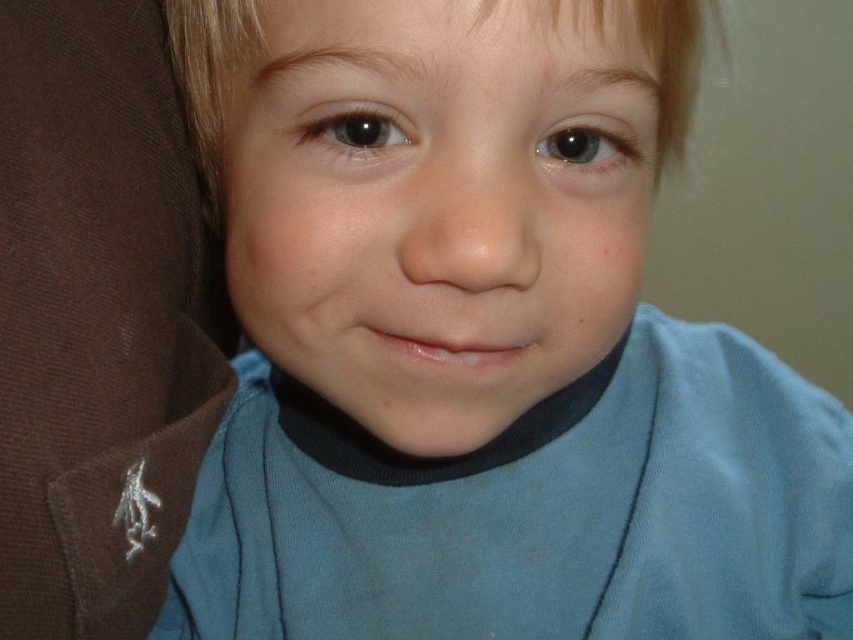
Who is more forward, (178, 488) or (171, 3)?

Point (171, 3)

Does matte brown fabric at left appear on the right side of blonde smooth hair at center?

No, matte brown fabric at left is not to the right of blonde smooth hair at center.

Where is `matte brown fabric at left`? The width and height of the screenshot is (853, 640). matte brown fabric at left is located at coordinates (97, 317).

Locate an element on the screen. This screenshot has width=853, height=640. matte brown fabric at left is located at coordinates (97, 317).